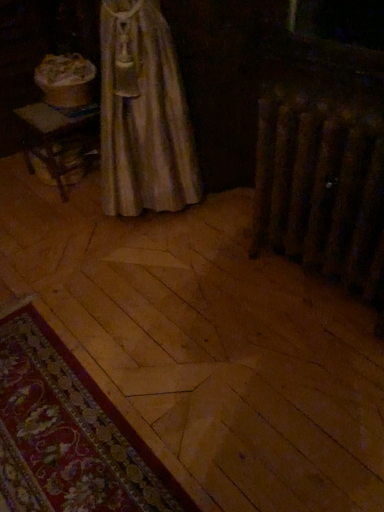
The image size is (384, 512). Identify the location of vacant space underneath rusty metal radiator at right (from a real-world perspective). (312, 282).